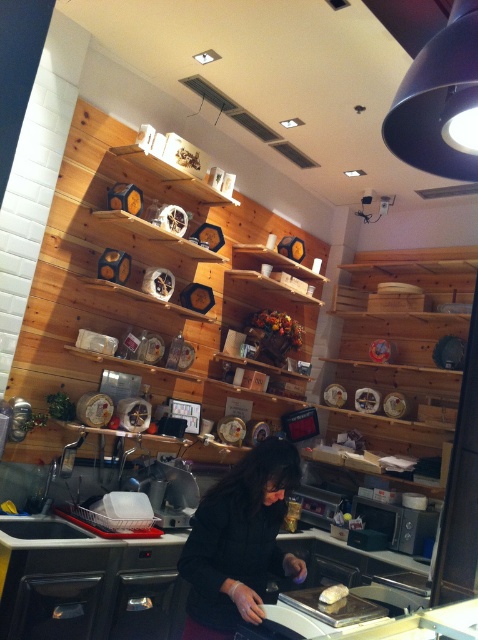
Question: Estimate the real-world distances between objects in this image. Which object is farther from the black fabric at center?

Choices:
 (A) white glossy bread at center
 (B) satin black exhaust hood at upper right

Answer: (B)

Question: Which point appears farthest from the camera in this image?

Choices:
 (A) (333, 598)
 (B) (283, 461)
 (C) (442, 147)

Answer: (A)

Question: Can you confirm if black fabric at center is smaller than satin black exhaust hood at upper right?

Choices:
 (A) no
 (B) yes

Answer: (A)

Question: Does black fabric at center have a lesser width compared to white glossy bread at center?

Choices:
 (A) no
 (B) yes

Answer: (A)

Question: Observing the image, what is the correct spatial positioning of black fabric at center in reference to satin black exhaust hood at upper right?

Choices:
 (A) right
 (B) left

Answer: (B)

Question: Which point is closer to the camera taking this photo?

Choices:
 (A) (344, 595)
 (B) (388, 124)

Answer: (B)